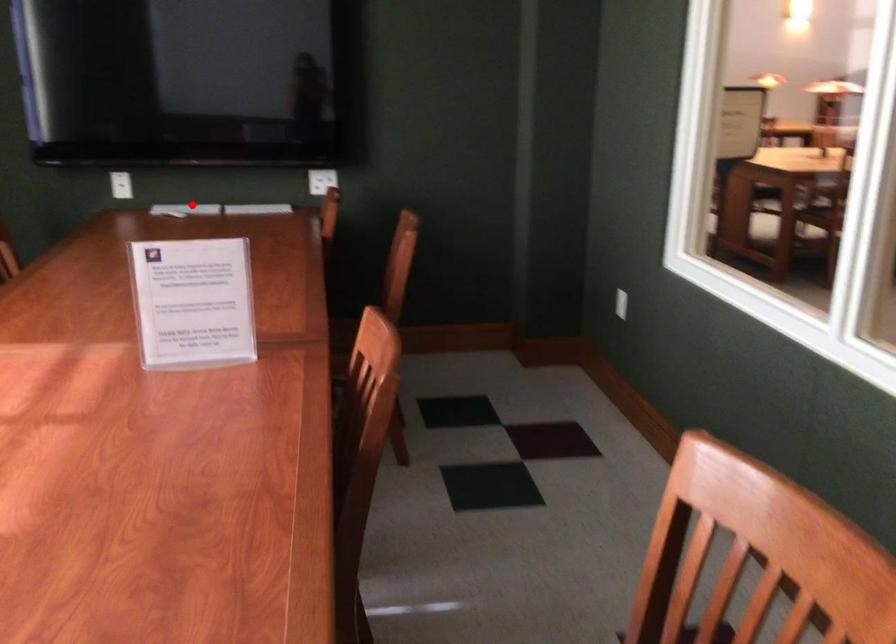
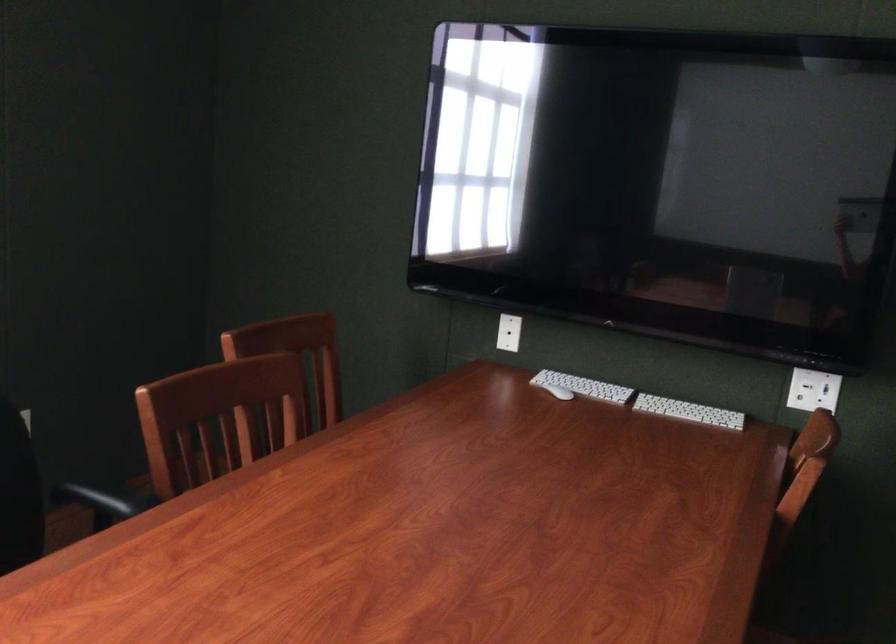
The point at the highlighted location is marked in the first image. Where is the corresponding point in the second image?

(583, 386)